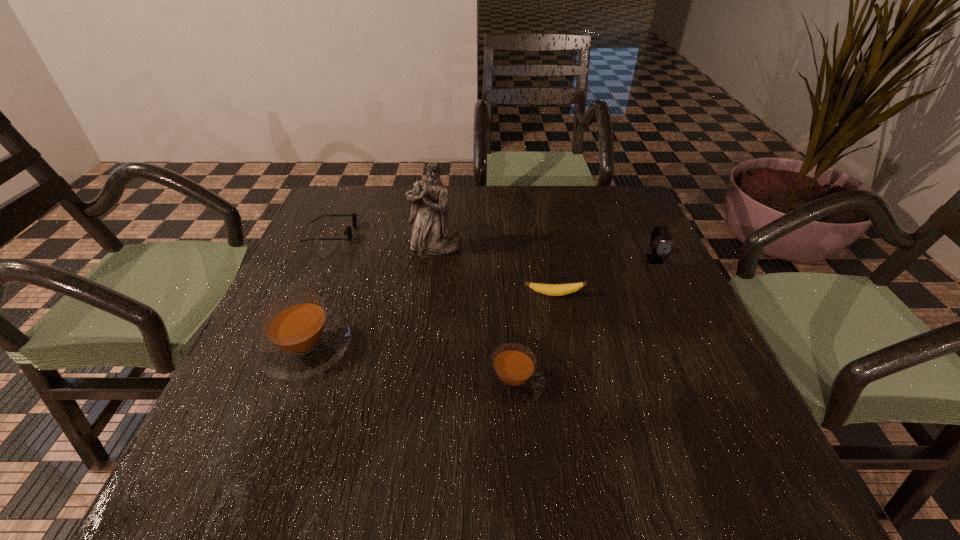
I want to click on vacant space located 0.130m on the right of the banana, so click(642, 294).

Locate an element on the screen. free space located 0.240m on the front-facing side of the tallest object is located at coordinates (425, 330).

Locate an element on the screen. The height and width of the screenshot is (540, 960). vacant position located on the face of the rightmost object is located at coordinates (714, 384).

Identify the location of vacant space located on the front-facing side of the sunglasses. This screenshot has width=960, height=540. (422, 233).

In order to click on object at the far edge in this screenshot , I will do `click(348, 231)`.

This screenshot has width=960, height=540. Find the location of `object that is positioned at the near edge`. object that is positioned at the near edge is located at coordinates (512, 377).

The width and height of the screenshot is (960, 540). I want to click on cappuccino that is positioned at the left edge, so click(x=302, y=338).

Where is `sunglasses positioned at the left edge`? The width and height of the screenshot is (960, 540). sunglasses positioned at the left edge is located at coordinates (348, 231).

Find the location of `object that is at the right edge`. object that is at the right edge is located at coordinates (665, 247).

I want to click on object that is at the far left corner, so click(x=348, y=231).